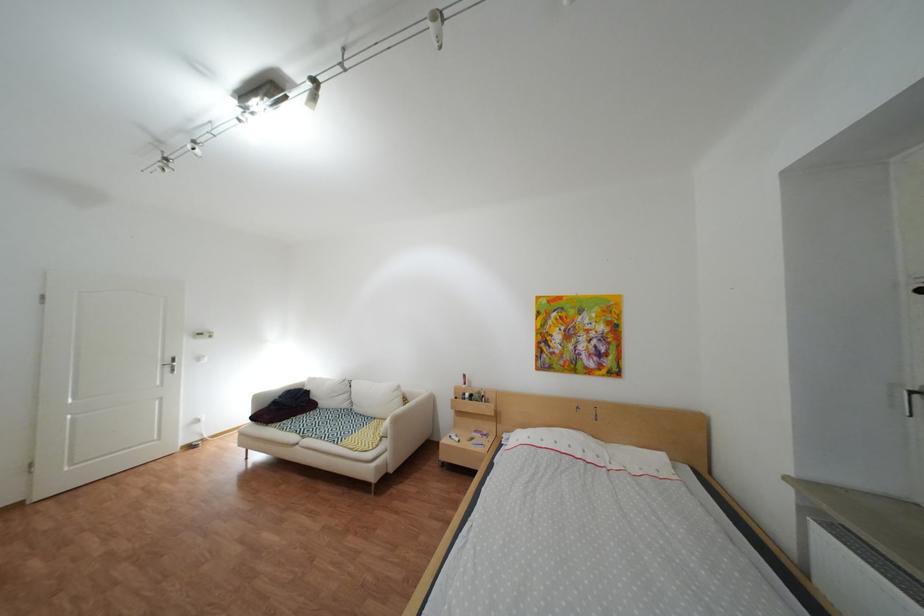
What do you see at coordinates (477, 436) in the screenshot?
I see `a nightstand drawer` at bounding box center [477, 436].